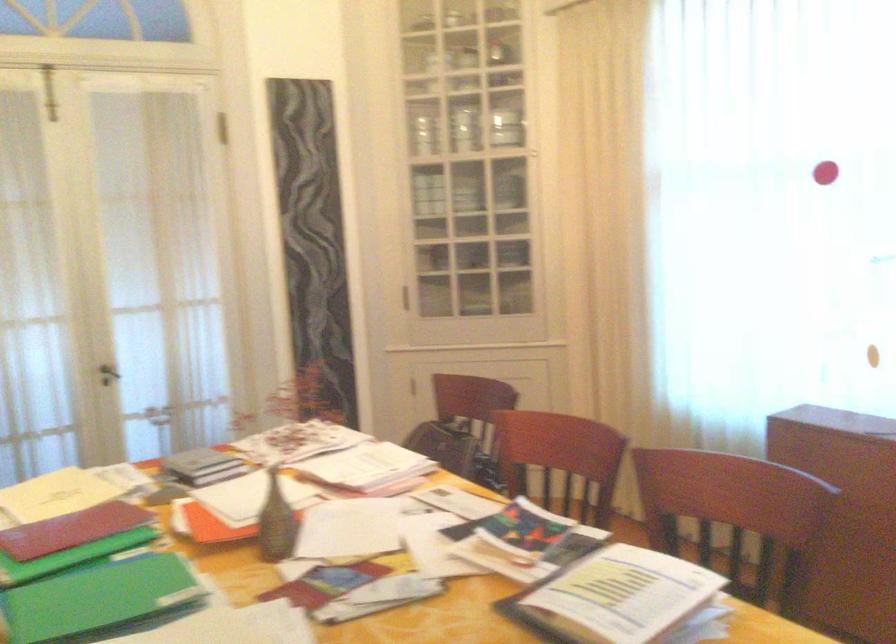
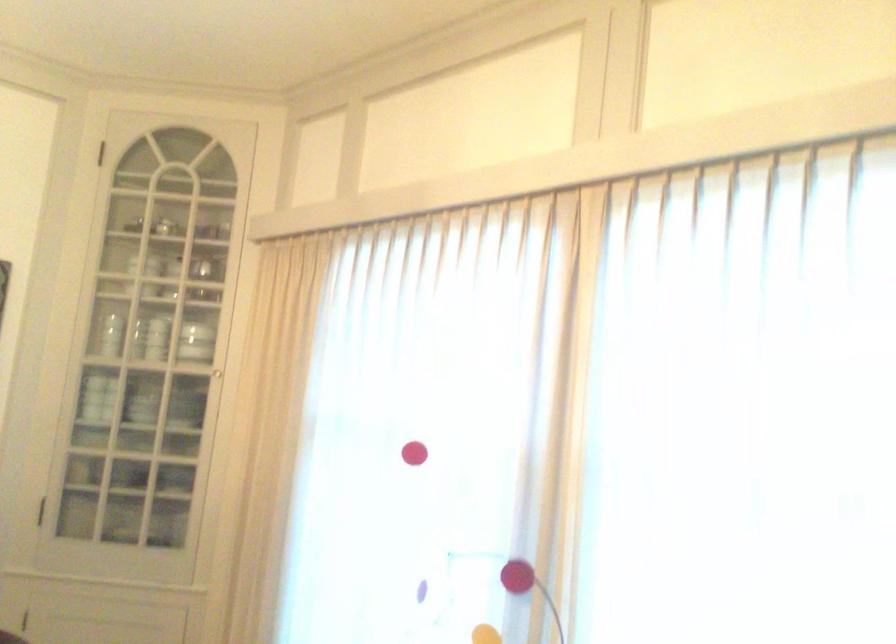
Question: Which direction would the cameraman need to move to produce the second image? Reply with the corresponding letter.

Choices:
 (A) Left
 (B) Right
 (C) Forward
 (D) Backward

Answer: (B)